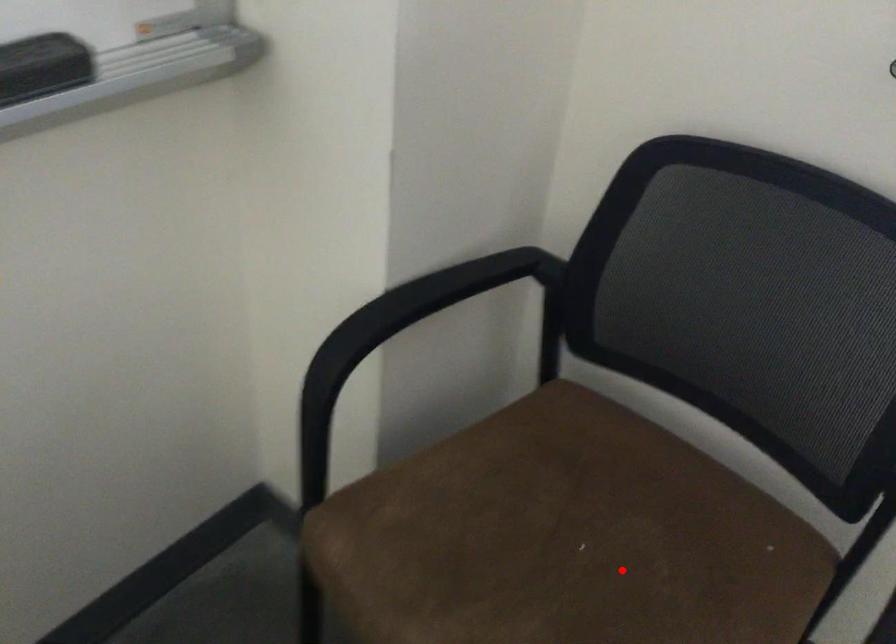
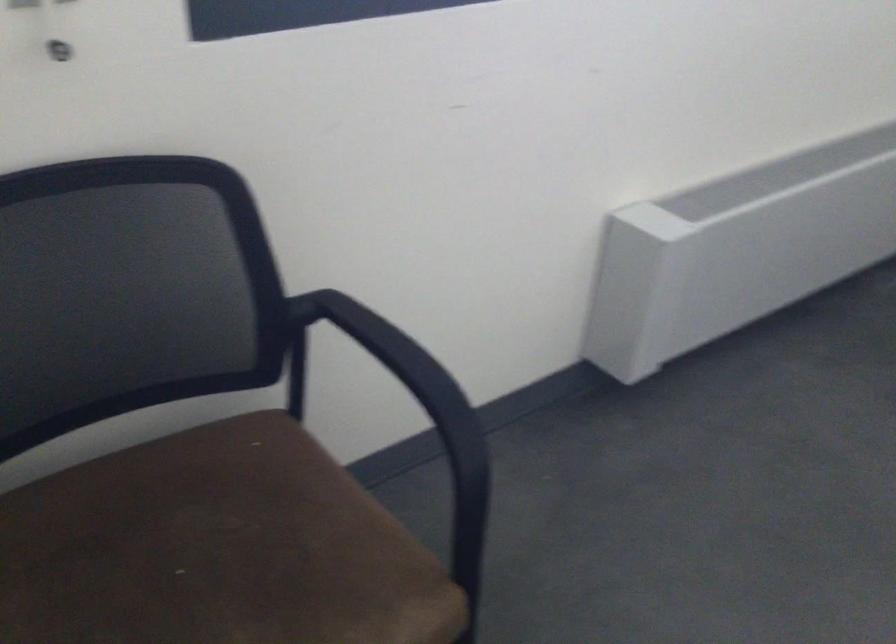
Find the pixel in the second image that matches the highlighted location in the first image.

(216, 549)